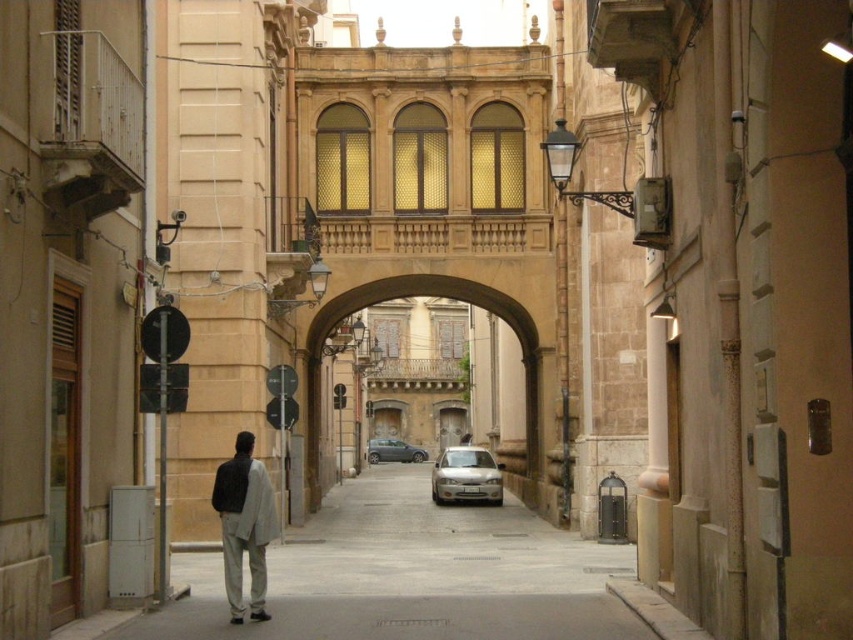
From the picture: Between matte stone archway at center and metallic gray sedan at center, which one appears on the right side from the viewer's perspective?

From the viewer's perspective, matte stone archway at center appears more on the right side.

Is matte stone archway at center positioned in front of metallic gray sedan at center?

Yes, it is.

What do you see at coordinates (440, 296) in the screenshot?
I see `matte stone archway at center` at bounding box center [440, 296].

Locate an element on the screen. matte stone archway at center is located at coordinates (440, 296).

Is matte stone archway at center below light beige pants at center?

Actually, matte stone archway at center is above light beige pants at center.

Where is `matte stone archway at center`? The width and height of the screenshot is (853, 640). matte stone archway at center is located at coordinates (440, 296).

Locate an element on the screen. The height and width of the screenshot is (640, 853). matte stone archway at center is located at coordinates [440, 296].

Can you confirm if gray concrete pavement at center is taller than metallic gray sedan at center?

Yes, gray concrete pavement at center is taller than metallic gray sedan at center.

Is gray concrete pavement at center below metallic gray sedan at center?

Incorrect, gray concrete pavement at center is not positioned below metallic gray sedan at center.

Does point (302, 540) come closer to viewer compared to point (378, 444)?

Yes, point (302, 540) is closer to viewer.

Identify the location of gray concrete pavement at center. The width and height of the screenshot is (853, 640). (412, 576).